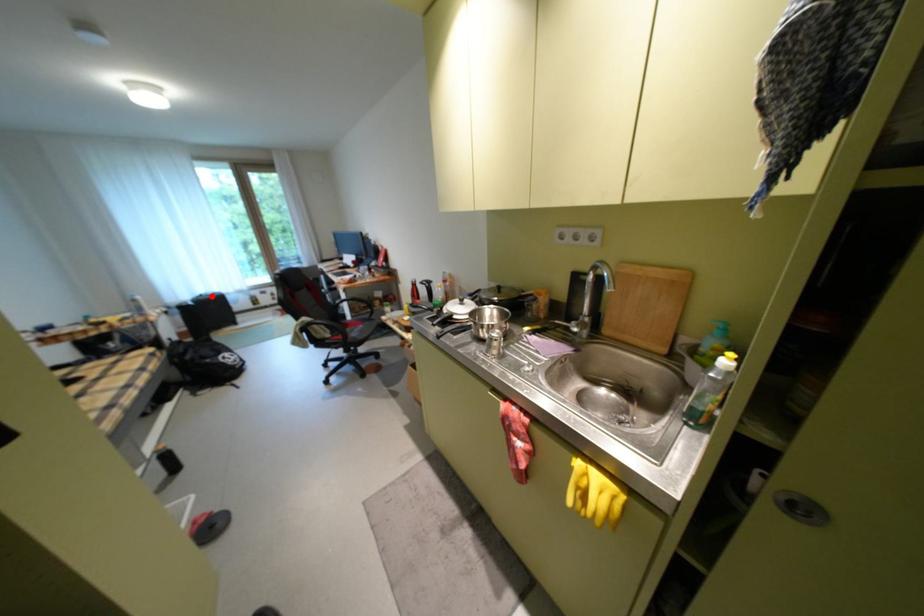
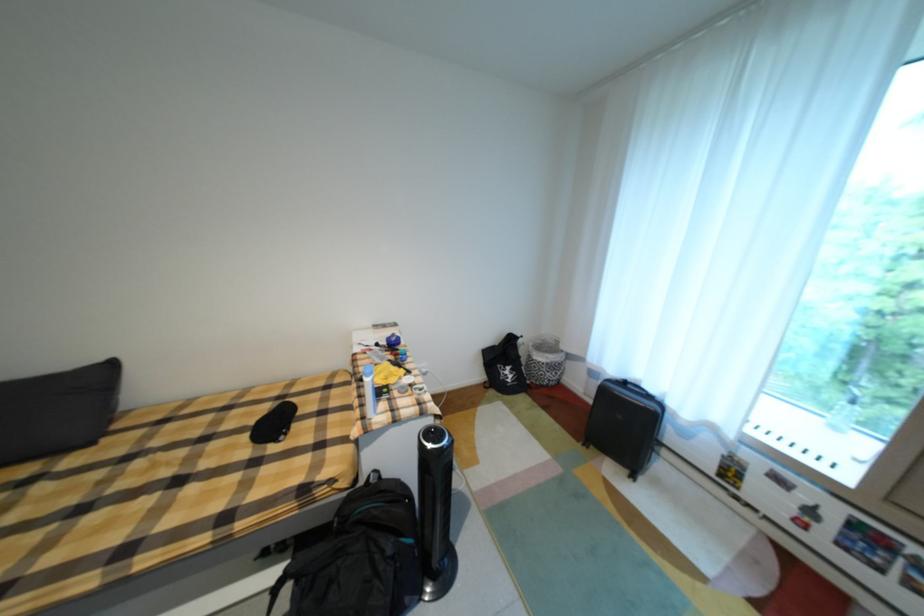
Question: I am providing you with two images of the same scene from different viewpoints. A red point is shown in image1. For the corresponding object point in image2, is it positioned nearer or farther from the camera?

Choices:
 (A) Nearer
 (B) Farther

Answer: (B)